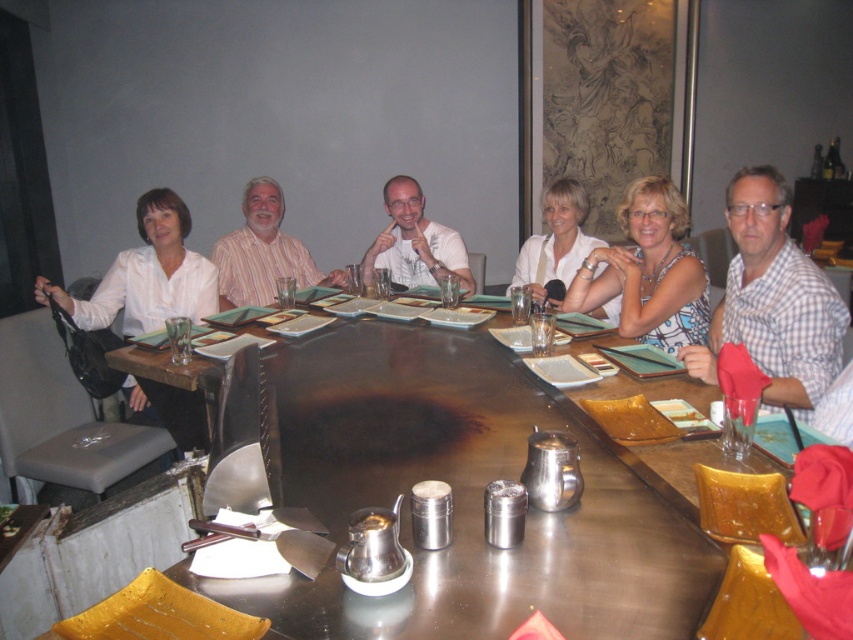
Question: From the image, what is the correct spatial relationship of striped cotton shirt at center in relation to matte white shirt at center?

Choices:
 (A) below
 (B) above

Answer: (B)

Question: Among these objects, which one is farthest from the camera?

Choices:
 (A) white fabric shirt at center
 (B) striped cotton shirt at center
 (C) white checkered shirt at right

Answer: (B)

Question: Does white textured blouse at center have a lesser width compared to striped cotton shirt at center?

Choices:
 (A) no
 (B) yes

Answer: (B)

Question: Can you confirm if metallic/reflective table at center is positioned to the left of white checkered shirt at right?

Choices:
 (A) no
 (B) yes

Answer: (B)

Question: Considering the real-world distances, which object is farthest from the white fabric shirt at center?

Choices:
 (A) white checkered shirt at right
 (B) white textured blouse at center

Answer: (A)

Question: Which point is farther to the camera?

Choices:
 (A) striped cotton shirt at center
 (B) white checkered shirt at right
 (C) white fabric shirt at center
 (D) white textured blouse at center

Answer: (A)